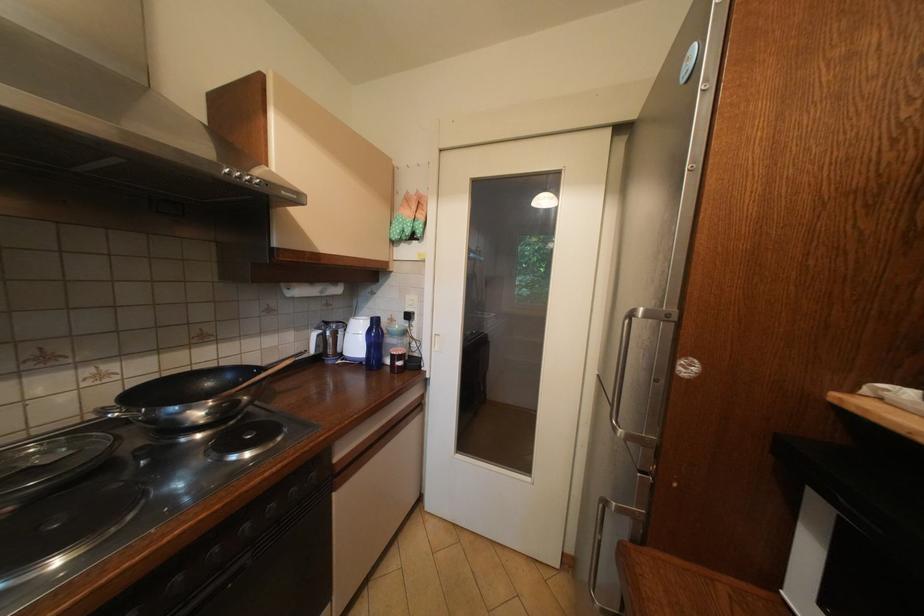
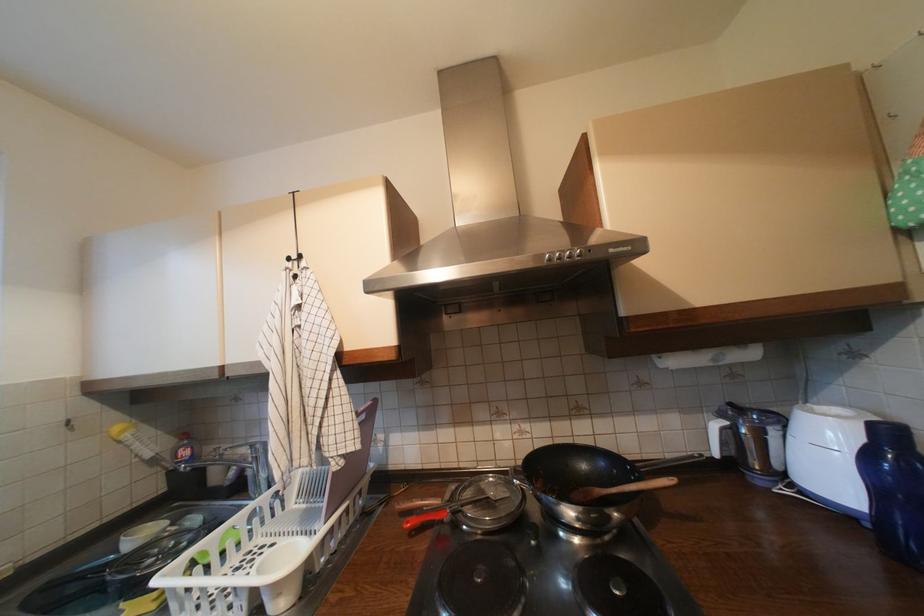
Find the pixel in the second image that matches pixel 377 326 in the first image.

(870, 440)